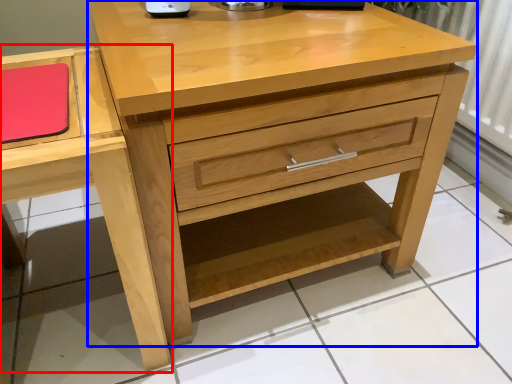
Question: Which object is closer to the camera taking this photo, vanity (highlighted by a red box) or chest of drawers (highlighted by a blue box)?

Choices:
 (A) vanity
 (B) chest of drawers

Answer: (A)